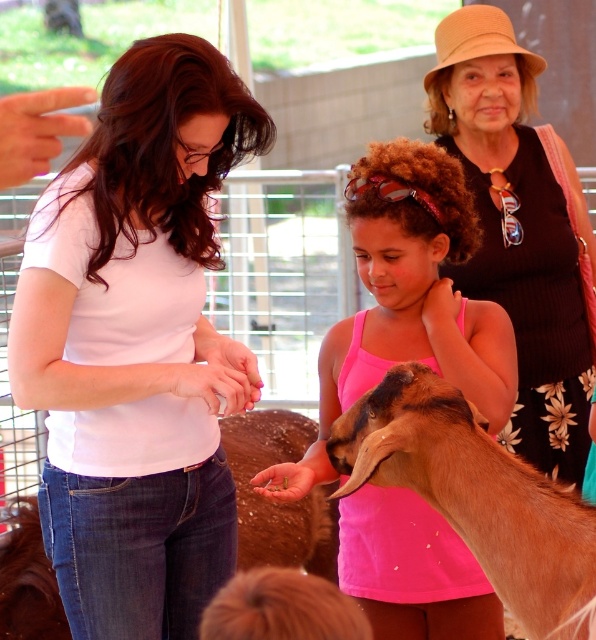
Does white matte shirt at center come behind brown fuzzy goat at center?

Yes.

From the picture: Can you confirm if white matte shirt at center is wider than brown fuzzy goat at center?

Yes.

Between point (250, 396) and point (395, 388), which one is positioned in front?

Point (395, 388) is more forward.

This screenshot has height=640, width=596. Find the location of `white matte shirt at center`. white matte shirt at center is located at coordinates (138, 346).

Looking at this image, which is below, pink fabric tank top at center or black ribbed tank top at upper right?

Positioned lower is pink fabric tank top at center.

Which of these two, pink fabric tank top at center or black ribbed tank top at upper right, stands shorter?

pink fabric tank top at center is shorter.

The width and height of the screenshot is (596, 640). Describe the element at coordinates (406, 300) in the screenshot. I see `pink fabric tank top at center` at that location.

Image resolution: width=596 pixels, height=640 pixels. What are the coordinates of `pink fabric tank top at center` in the screenshot? It's located at (406, 300).

In order to click on white matte shirt at center in this screenshot , I will do `click(138, 346)`.

From the picture: Between white matte shirt at center and pink fabric tank top at center, which one appears on the right side from the viewer's perspective?

pink fabric tank top at center is more to the right.

Where is `white matte shirt at center`? white matte shirt at center is located at coordinates (138, 346).